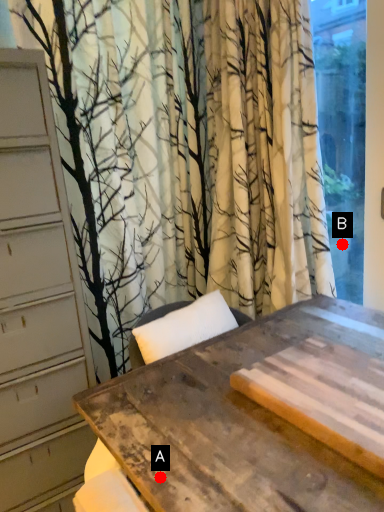
Question: Two points are circled on the image, labeled by A and B beside each circle. Which point is closer to the camera?

Choices:
 (A) A is closer
 (B) B is closer

Answer: (A)